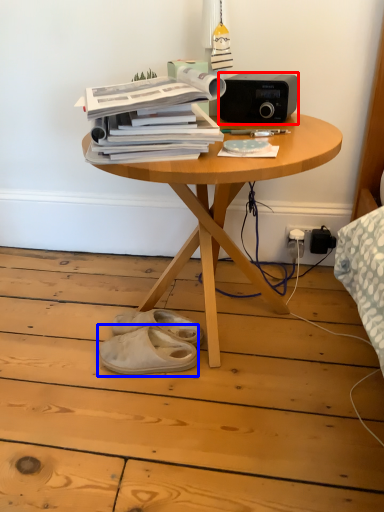
Question: Which object appears farthest to the camera in this image, stereo (highlighted by a red box) or footwear (highlighted by a blue box)?

Choices:
 (A) stereo
 (B) footwear

Answer: (B)